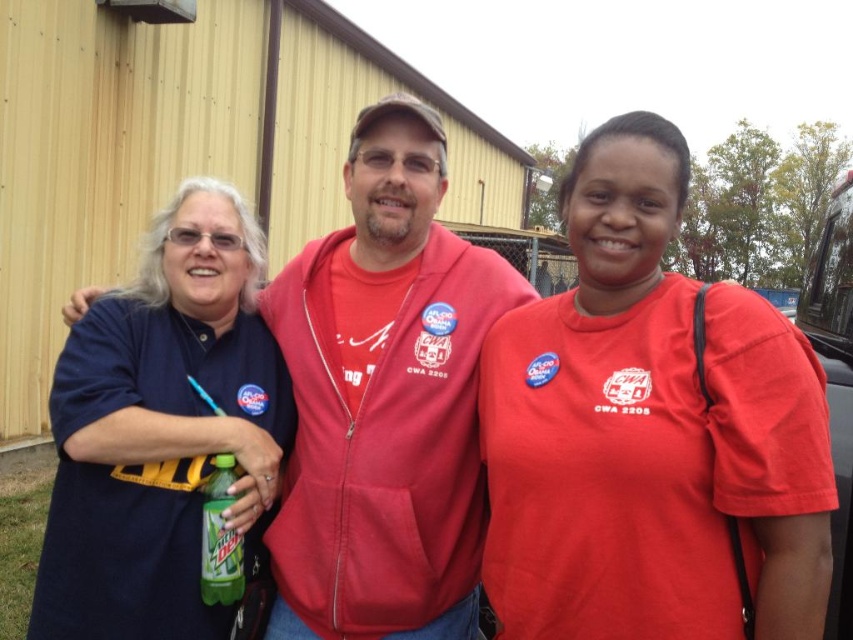
In the scene shown: Who is lower down, navy blue shirt at left or green matte mountain dew bottle at center?

green matte mountain dew bottle at center is below.

Can you confirm if navy blue shirt at left is smaller than green matte mountain dew bottle at center?

Incorrect, navy blue shirt at left is not smaller in size than green matte mountain dew bottle at center.

Who is more distant from viewer, (207, 474) or (229, 493)?

The point (207, 474) is more distant.

You are a GUI agent. You are given a task and a screenshot of the screen. Output one action in this format:
    pyautogui.click(x=<x>, y=<y>)
    Task: Click on the navy blue shirt at left
    
    Given the screenshot: What is the action you would take?
    pyautogui.click(x=161, y=429)

Looking at this image, between matte red shirt at center and navy blue shirt at left, which one has less height?

With less height is navy blue shirt at left.

Is point (563, 332) closer to viewer compared to point (71, 392)?

Yes, point (563, 332) is closer to viewer.

The height and width of the screenshot is (640, 853). What do you see at coordinates (651, 432) in the screenshot?
I see `matte red shirt at center` at bounding box center [651, 432].

Where is `matte red shirt at center`? matte red shirt at center is located at coordinates (651, 432).

Who is positioned more to the right, matte red hoodie at center or navy blue shirt at left?

Positioned to the right is matte red hoodie at center.

Consider the image. Who is more distant from viewer, (442, 227) or (198, 216)?

The point (442, 227) is behind.

Which is in front, point (305, 538) or point (258, 378)?

Point (305, 538) is more forward.

Locate an element on the screen. matte red hoodie at center is located at coordinates (386, 400).